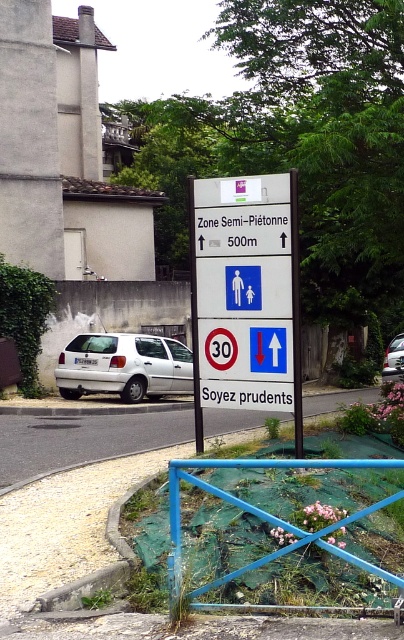
Question: Considering the relative positions of blue painted metal fence at lower center and metallic signpost at center in the image provided, where is blue painted metal fence at lower center located with respect to metallic signpost at center?

Choices:
 (A) below
 (B) above

Answer: (A)

Question: From the image, what is the correct spatial relationship of blue painted metal fence at lower center in relation to white plastic sign at upper center?

Choices:
 (A) below
 (B) above

Answer: (A)

Question: Which of the following is the farthest from the observer?

Choices:
 (A) blue painted metal fence at lower center
 (B) white matte car at center
 (C) metallic signpost at center

Answer: (B)

Question: Which of these objects is positioned farthest from the white matte hatchback at center?

Choices:
 (A) white plastic sign at upper center
 (B) white matte car at center
 (C) metallic signpost at center
 (D) blue painted metal fence at lower center

Answer: (D)

Question: Which point is closer to the camera?

Choices:
 (A) white matte car at center
 (B) blue painted metal fence at lower center
 (C) metallic signpost at center

Answer: (B)

Question: Does white matte hatchback at center have a greater width compared to white matte car at center?

Choices:
 (A) no
 (B) yes

Answer: (B)